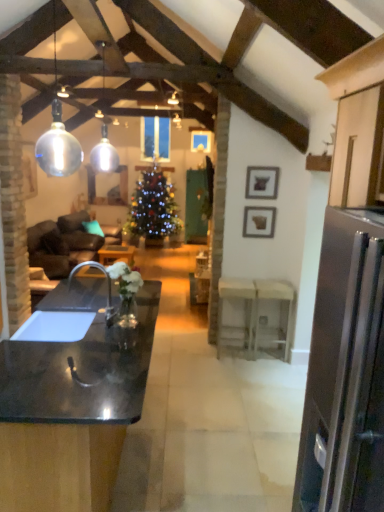
Describe the element at coordinates (55, 326) in the screenshot. I see `black matte sink at lower left` at that location.

Measure the distance between black matte sink at lower left and camera.

A distance of 2.54 meters exists between black matte sink at lower left and camera.

I want to click on glossy black countertop at center, so click(x=71, y=413).

Find the location of a particular element. This screenshot has width=384, height=512. white glossy table at center, the 2th table from the back is located at coordinates (257, 313).

Describe the element at coordinates (257, 313) in the screenshot. I see `white glossy table at center, which is the third table from left to right` at that location.

What do you see at coordinates (104, 153) in the screenshot? The image size is (384, 512). I see `metallic glass pendant light at upper center, which is the 1th lamp from back to front` at bounding box center [104, 153].

Image resolution: width=384 pixels, height=512 pixels. What do you see at coordinates (58, 137) in the screenshot?
I see `transparent glass pendant light at upper left, the 2th lamp positioned from the back` at bounding box center [58, 137].

Locate an element on the screen. The width and height of the screenshot is (384, 512). black matte sink at lower left is located at coordinates (55, 326).

Find the location of a particular element. This screenshot has height=512, width=384. sink beneath the metallic glass pendant light at upper center, which is counted as the 2th lamp, starting from the front (from a real-world perspective) is located at coordinates (55, 326).

Considering the relative sizes of metallic glass pendant light at upper center, which is the 1th lamp from back to front, and black matte sink at lower left in the image provided, is metallic glass pendant light at upper center, which is the 1th lamp from back to front, smaller than black matte sink at lower left?

Indeed, metallic glass pendant light at upper center, which is the 1th lamp from back to front, has a smaller size compared to black matte sink at lower left.

Can you tell me how much metallic glass pendant light at upper center, which is counted as the 2th lamp, starting from the front, and black matte sink at lower left differ in facing direction?

87.9 degrees separate the facing orientations of metallic glass pendant light at upper center, which is counted as the 2th lamp, starting from the front, and black matte sink at lower left.

Is black matte sink at lower left turned away from dark brown leather couch at left?

No, black matte sink at lower left is not facing away from dark brown leather couch at left.

Is black matte sink at lower left next to dark brown leather couch at left?

No, black matte sink at lower left is not beside dark brown leather couch at left.

In the scene shown: Between black matte sink at lower left and dark brown leather couch at left, which one has larger size?

dark brown leather couch at left is bigger.

Which is in front, point (30, 332) or point (118, 232)?

The point (30, 332) is in front.

From a real-world perspective, is white wood table at center, the 3th table from the back, located higher than black matte sink at lower left?

No, from a real-world perspective, white wood table at center, the 3th table from the back, is not on top of black matte sink at lower left.

Is white wood table at center, the first table from the front, wider than black matte sink at lower left?

No, white wood table at center, the first table from the front, is not wider than black matte sink at lower left.

Is black matte sink at lower left at the back of white wood table at center, the first table from the front?

No, white wood table at center, the first table from the front, is not facing away from black matte sink at lower left.

How different are the orientations of white wood table at center, the 3th table from the back, and black matte sink at lower left in degrees?

The angle between the facing direction of white wood table at center, the 3th table from the back, and the facing direction of black matte sink at lower left is 88.5 degrees.

Is wooden picture frame at upper center, which is the second picture frame in back-to-front order, not close to black matte sink at lower left?

wooden picture frame at upper center, which is the second picture frame in back-to-front order, is far away from black matte sink at lower left.

Locate an element on the screen. Image resolution: width=384 pixels, height=512 pixels. sink below the wooden picture frame at upper center, placed as the 2th picture frame when sorted from bottom to top (from the image's perspective) is located at coordinates [55, 326].

From the image's perspective, is wooden picture frame at upper center, positioned as the 1th picture frame in front-to-back order, above black matte sink at lower left?

Yes.

Looking at their sizes, would you say wooden picture frame at upper center, the 1th picture frame viewed from the top, is wider or thinner than black matte sink at lower left?

wooden picture frame at upper center, the 1th picture frame viewed from the top, is thinner than black matte sink at lower left.

Considering the positions of points (259, 231) and (44, 165), is point (259, 231) closer to camera compared to point (44, 165)?

No, it is not.

Is there a large distance between matte gray picture frame at upper right, which is the 1th picture frame in bottom-to-top order, and transparent glass pendant light at upper left, the 2th lamp positioned from the back?

Absolutely, matte gray picture frame at upper right, which is the 1th picture frame in bottom-to-top order, is distant from transparent glass pendant light at upper left, the 2th lamp positioned from the back.

From a real-world perspective, which object rests below the other?

From a 3D spatial view, matte gray picture frame at upper right, positioned as the 1th picture frame in back-to-front order, is below.

Considering the sizes of matte gray picture frame at upper right, which ranks as the second picture frame in top-to-bottom order, and transparent glass pendant light at upper left, the 2th lamp positioned from the back, in the image, is matte gray picture frame at upper right, which ranks as the second picture frame in top-to-bottom order, wider or thinner than transparent glass pendant light at upper left, the 2th lamp positioned from the back,?

Considering their sizes, matte gray picture frame at upper right, which ranks as the second picture frame in top-to-bottom order, looks slimmer than transparent glass pendant light at upper left, the 2th lamp positioned from the back.

In the image, is white glossy table at center, which ranks as the first table in left-to-right order, positioned in front of or behind dark brown leather couch at left?

Clearly, white glossy table at center, which ranks as the first table in left-to-right order, is in front of dark brown leather couch at left.

Which object is positioned more to the left, white glossy table at center, positioned as the third table in right-to-left order, or dark brown leather couch at left?

Positioned to the left is dark brown leather couch at left.

In terms of size, does white glossy table at center, positioned as the third table in right-to-left order, appear bigger or smaller than dark brown leather couch at left?

Clearly, white glossy table at center, positioned as the third table in right-to-left order, is smaller in size than dark brown leather couch at left.

Does dark brown leather couch at left turn towards transparent glass pendant light at upper left, the 1th lamp positioned from the front?

No, dark brown leather couch at left does not turn towards transparent glass pendant light at upper left, the 1th lamp positioned from the front.

How distant is dark brown leather couch at left from transparent glass pendant light at upper left, the 2th lamp positioned from the back?

The distance of dark brown leather couch at left from transparent glass pendant light at upper left, the 2th lamp positioned from the back, is 6.01 feet.

Between dark brown leather couch at left and transparent glass pendant light at upper left, the 1th lamp positioned from the front, which one appears on the left side from the viewer's perspective?

dark brown leather couch at left.

From a real-world perspective, which object stands above the other?

transparent glass pendant light at upper left, the 2th lamp positioned from the back.

There is a black matte sink at lower left. At what (x,y) coordinates should I click in order to perform the action: click on the 2nd lamp above it (from the image's perspective). Please return your answer as a coordinate pair (x, y). Looking at the image, I should click on (104, 153).

I want to click on sink that appears on the right of dark brown leather couch at left, so click(55, 326).

Based on their spatial positions, is glossy black countertop at center or metallic glass pendant light at upper center, which is counted as the 2th lamp, starting from the front, further from black matte sink at lower left?

The object further to black matte sink at lower left is metallic glass pendant light at upper center, which is counted as the 2th lamp, starting from the front.

Which object lies nearer to the anchor point wooden picture frame at upper center, positioned as the 1th picture frame in front-to-back order, shiny green christmas tree at center or dark brown leather couch at left?

The object closer to wooden picture frame at upper center, positioned as the 1th picture frame in front-to-back order, is dark brown leather couch at left.

Estimate the real-world distances between objects in this image. Which object is closer to dark brown leather couch at left, matte gray picture frame at upper right, which is the 1th picture frame in bottom-to-top order, or transparent glass pendant light at upper left, the 2th lamp positioned from the back?

transparent glass pendant light at upper left, the 2th lamp positioned from the back, lies closer to dark brown leather couch at left than the other object.

When comparing their distances from white glossy table at center, the 2th table from the back, does glossy black countertop at center or matte gray picture frame at upper right, positioned as the 1th picture frame in back-to-front order, seem closer?

matte gray picture frame at upper right, positioned as the 1th picture frame in back-to-front order, is positioned closer to the anchor white glossy table at center, the 2th table from the back.

In the scene shown: Which object lies nearer to the anchor point white glossy table at center, the first table in the back-to-front sequence, matte gray picture frame at upper right, which is the 1th picture frame in bottom-to-top order, or glossy black countertop at center?

matte gray picture frame at upper right, which is the 1th picture frame in bottom-to-top order, is closer to white glossy table at center, the first table in the back-to-front sequence.

When comparing their distances from wooden picture frame at upper center, placed as the 2th picture frame when sorted from bottom to top, does metallic glass pendant light at upper center, which is the 1th lamp from back to front, or shiny green christmas tree at center seem closer?

Among the two, metallic glass pendant light at upper center, which is the 1th lamp from back to front, is located nearer to wooden picture frame at upper center, placed as the 2th picture frame when sorted from bottom to top.

When comparing their distances from metallic glass pendant light at upper center, which is the 1th lamp from back to front, does transparent glass pendant light at upper left, the 2th lamp positioned from the back, or white wood table at center, the 3th table from the back, seem closer?

transparent glass pendant light at upper left, the 2th lamp positioned from the back, is positioned closer to the anchor metallic glass pendant light at upper center, which is the 1th lamp from back to front.

Which object lies further to the anchor point black matte sink at lower left, white wood table at center, the 2th table when ordered from left to right, or dark brown leather couch at left?

The object further to black matte sink at lower left is dark brown leather couch at left.

You are a GUI agent. You are given a task and a screenshot of the screen. Output one action in this format:
    pyautogui.click(x=<x>, y=<y>)
    Task: Click on the lamp positioned between black matte sink at lower left and matte gray picture frame at upper right, which is the 1th picture frame in bottom-to-top order, from near to far
    Image resolution: width=384 pixels, height=512 pixels.
    Given the screenshot: What is the action you would take?
    pyautogui.click(x=104, y=153)

Identify the location of table between glossy black countertop at center and white glossy table at center, positioned as the first table in right-to-left order, from front to back. (247, 310).

Where is `sink between glossy black countertop at center and white wood table at center, the 2th table when ordered from left to right, in the front-back direction`? sink between glossy black countertop at center and white wood table at center, the 2th table when ordered from left to right, in the front-back direction is located at coordinates (55, 326).

The height and width of the screenshot is (512, 384). Find the location of `lamp between glossy black countertop at center and dark brown leather couch at left along the z-axis`. lamp between glossy black countertop at center and dark brown leather couch at left along the z-axis is located at coordinates (104, 153).